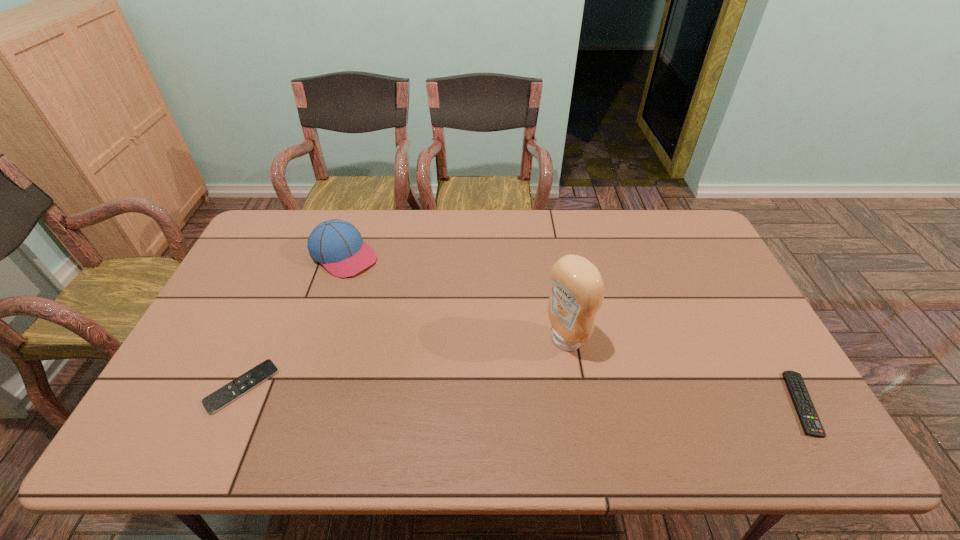
Image resolution: width=960 pixels, height=540 pixels. In order to click on vacant space on the desktop that is between the left remote control and the rightmost object and is positioned on the front-facing side of the baseball cap in this screenshot , I will do `click(531, 395)`.

Find the location of a particular element. This screenshot has height=540, width=960. free spot on the desktop that is between the shortest object and the taller remote control and is positioned on the label of the third object from left to right is located at coordinates (466, 393).